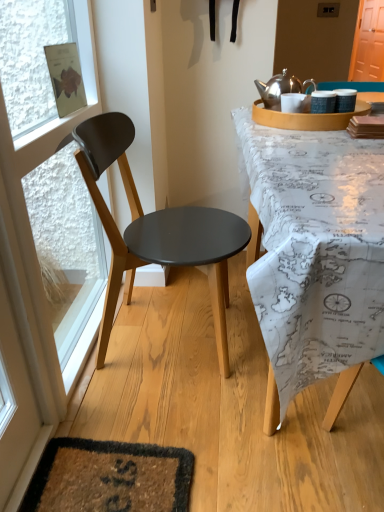
Question: From a real-world perspective, is orange wood screen door at upper right physically located above or below matte black chair at left?

Choices:
 (A) below
 (B) above

Answer: (B)

Question: Considering the positions of orange wood screen door at upper right and matte black chair at left in the image, is orange wood screen door at upper right taller or shorter than matte black chair at left?

Choices:
 (A) short
 (B) tall

Answer: (B)

Question: Estimate the real-world distances between objects in this image. Which object is farther from the shiny metallic kettle at upper right?

Choices:
 (A) orange wood screen door at upper right
 (B) transparent glass door at left
 (C) matte black chair at left

Answer: (A)

Question: Which object is the farthest from the transparent glass door at left?

Choices:
 (A) orange wood screen door at upper right
 (B) matte black chair at left
 (C) shiny metallic kettle at upper right

Answer: (A)